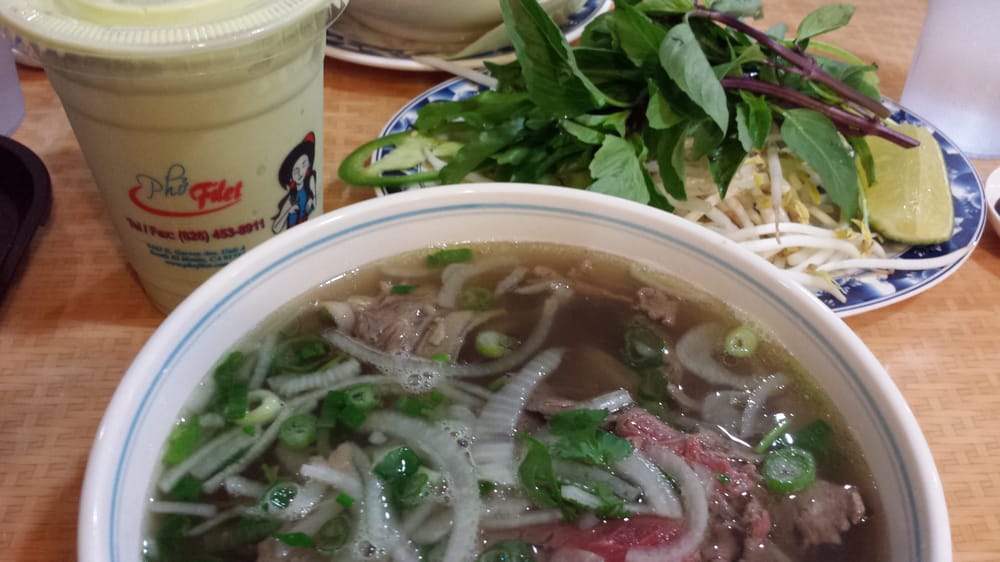
At what (x,y) coordinates should I click in order to perform the action: click on plate. Please return your answer as a coordinate pair (x, y). Looking at the image, I should click on (969, 196).